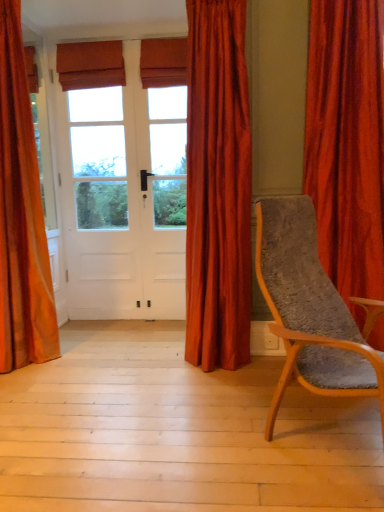
Question: From a real-world perspective, is light wood floor at lower center positioned under satin red curtain at center, positioned as the 2th curtain in left-to-right order, based on gravity?

Choices:
 (A) no
 (B) yes

Answer: (B)

Question: From a real-world perspective, is light wood floor at lower center located higher than satin red curtain at center, positioned as the 2th curtain in left-to-right order?

Choices:
 (A) yes
 (B) no

Answer: (B)

Question: Would you consider light wood floor at lower center to be distant from satin red curtain at center, positioned as the 2th curtain in left-to-right order?

Choices:
 (A) yes
 (B) no

Answer: (B)

Question: From the image's perspective, is light wood floor at lower center beneath satin red curtain at center, positioned as the 2th curtain in left-to-right order?

Choices:
 (A) yes
 (B) no

Answer: (A)

Question: Is light wood floor at lower center outside of satin red curtain at center, which is the 2th curtain in right-to-left order?

Choices:
 (A) no
 (B) yes

Answer: (B)

Question: In terms of height, does white wood screen door at center look taller or shorter compared to velvet orange curtain at left, positioned as the 3th curtain in right-to-left order?

Choices:
 (A) short
 (B) tall

Answer: (A)

Question: Considering the positions of white wood screen door at center and velvet orange curtain at left, the first curtain in the left-to-right sequence, in the image, is white wood screen door at center wider or thinner than velvet orange curtain at left, the first curtain in the left-to-right sequence,?

Choices:
 (A) thin
 (B) wide

Answer: (A)

Question: Is white wood screen door at center inside or outside of velvet orange curtain at left, the first curtain in the left-to-right sequence?

Choices:
 (A) inside
 (B) outside

Answer: (B)

Question: From the image's perspective, relative to velvet orange curtain at left, positioned as the 3th curtain in right-to-left order, is white wood screen door at center above or below?

Choices:
 (A) below
 (B) above

Answer: (B)

Question: Looking at their shapes, would you say wooden textured chair at right is wider or thinner than velvet orange curtain at right, arranged as the 3th curtain when viewed from the left?

Choices:
 (A) thin
 (B) wide

Answer: (B)

Question: From a real-world perspective, relative to velvet orange curtain at right, the first curtain viewed from the right, is wooden textured chair at right vertically above or below?

Choices:
 (A) above
 (B) below

Answer: (B)

Question: In terms of size, does wooden textured chair at right appear bigger or smaller than velvet orange curtain at right, arranged as the 3th curtain when viewed from the left?

Choices:
 (A) big
 (B) small

Answer: (A)

Question: Relative to velvet orange curtain at right, arranged as the 3th curtain when viewed from the left, is wooden textured chair at right in front or behind?

Choices:
 (A) front
 (B) behind

Answer: (A)

Question: Is velvet orange curtain at left, positioned as the 3th curtain in right-to-left order, taller or shorter than wooden textured chair at right?

Choices:
 (A) tall
 (B) short

Answer: (A)

Question: Would you say velvet orange curtain at left, the first curtain in the left-to-right sequence, is to the left or to the right of wooden textured chair at right in the picture?

Choices:
 (A) left
 (B) right

Answer: (A)